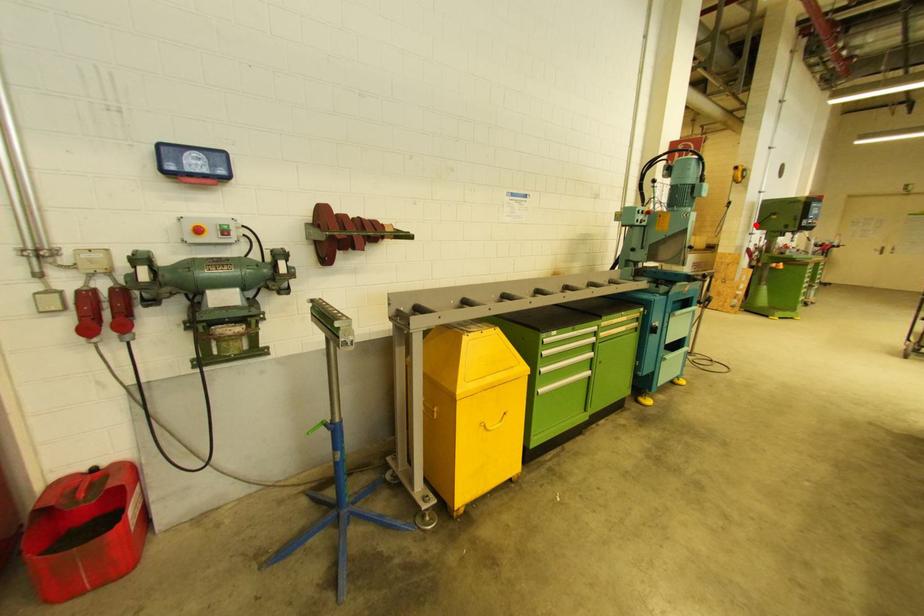
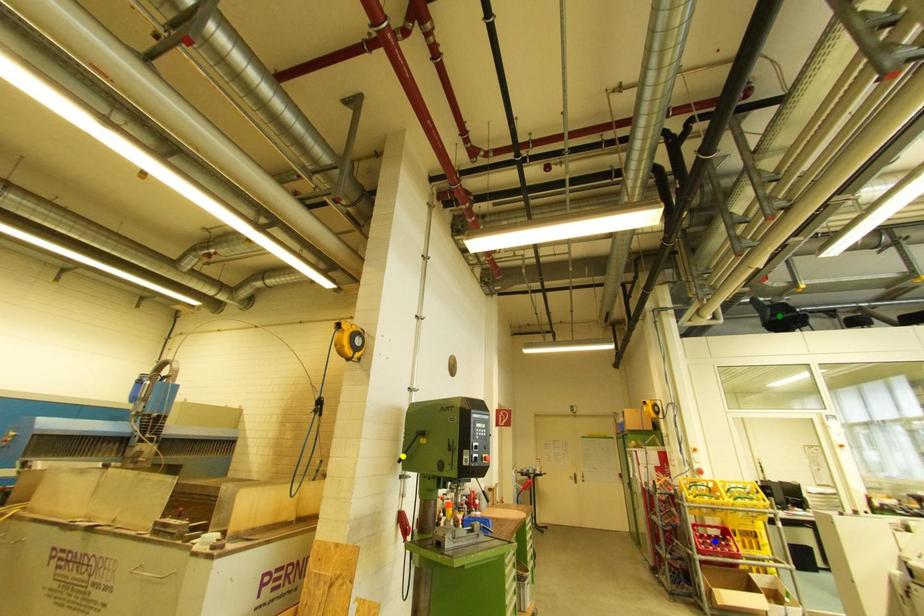
Question: I am providing you with two images of the same scene from different viewpoints. A red point is marked on the first image. You are given multiple points on the second image. In image 2, which mark is for the same physical point as the one in image 1?

Choices:
 (A) blue point
 (B) green point
 (C) yellow point

Answer: (C)